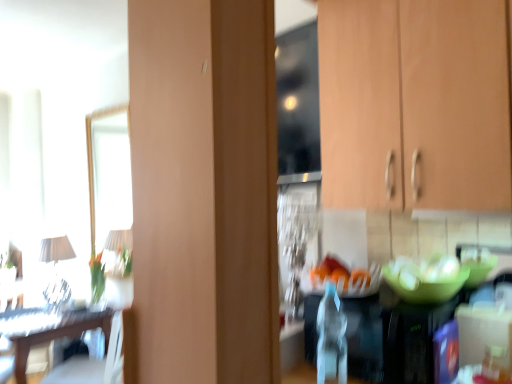
Question: Are green matte glass bowl at center and wooden cabinet at upper right far apart?

Choices:
 (A) yes
 (B) no

Answer: (B)

Question: Is green matte glass bowl at center at the left side of wooden cabinet at upper right?

Choices:
 (A) yes
 (B) no

Answer: (B)

Question: From the image's perspective, would you say green matte glass bowl at center is positioned over wooden cabinet at upper right?

Choices:
 (A) yes
 (B) no

Answer: (B)

Question: Is the position of green matte glass bowl at center less distant than that of wooden cabinet at upper right?

Choices:
 (A) yes
 (B) no

Answer: (B)

Question: Considering the relative sizes of green matte glass bowl at center and wooden cabinet at upper right in the image provided, is green matte glass bowl at center smaller than wooden cabinet at upper right?

Choices:
 (A) no
 (B) yes

Answer: (B)

Question: Do you think wooden cabinet at upper right is within white fabric lampshade at left, or outside of it?

Choices:
 (A) inside
 (B) outside

Answer: (B)

Question: In the image, is wooden cabinet at upper right on the left side or the right side of white fabric lampshade at left?

Choices:
 (A) left
 (B) right

Answer: (B)

Question: Does point [x=485, y=180] appear closer or farther from the camera than point [x=51, y=259]?

Choices:
 (A) closer
 (B) farther

Answer: (A)

Question: In terms of width, does wooden cabinet at upper right look wider or thinner when compared to white fabric lampshade at left?

Choices:
 (A) wide
 (B) thin

Answer: (A)

Question: From the image's perspective, is wooden table at left positioned above or below wooden cabinet at upper right?

Choices:
 (A) above
 (B) below

Answer: (B)

Question: Relative to wooden cabinet at upper right, is wooden table at left in front or behind?

Choices:
 (A) front
 (B) behind

Answer: (B)

Question: Considering the positions of point (25, 339) and point (325, 99), is point (25, 339) closer or farther from the camera than point (325, 99)?

Choices:
 (A) farther
 (B) closer

Answer: (A)

Question: In terms of height, does wooden table at left look taller or shorter compared to wooden cabinet at upper right?

Choices:
 (A) tall
 (B) short

Answer: (B)

Question: Is wooden cabinet at upper right wider or thinner than wooden table at left?

Choices:
 (A) wide
 (B) thin

Answer: (B)

Question: Is wooden cabinet at upper right in front of or behind wooden table at left in the image?

Choices:
 (A) behind
 (B) front

Answer: (B)